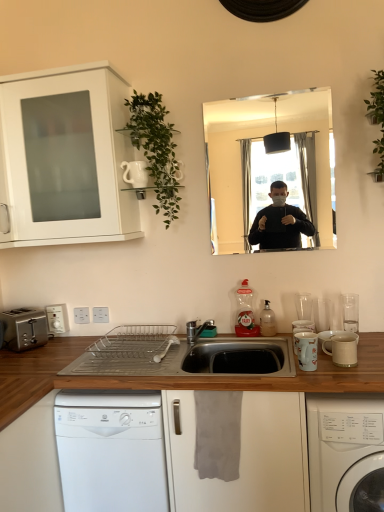
Locate an element on the screen. This screenshot has width=384, height=512. vacant point to the right of translucent plastic bottle at sink, marked as the 1th bottle in a left-to-right arrangement is located at coordinates (271, 339).